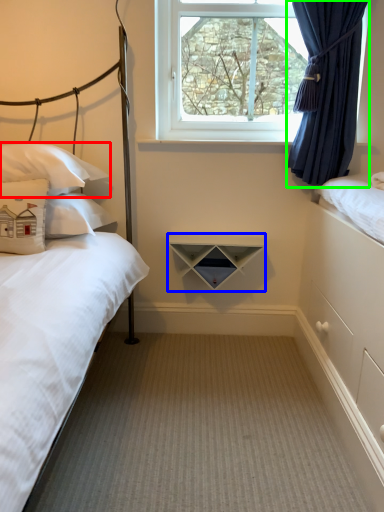
Question: Considering the real-world distances, which object is farthest from pillow (highlighted by a red box)? shelf (highlighted by a blue box) or curtain (highlighted by a green box)?

Choices:
 (A) shelf
 (B) curtain

Answer: (B)